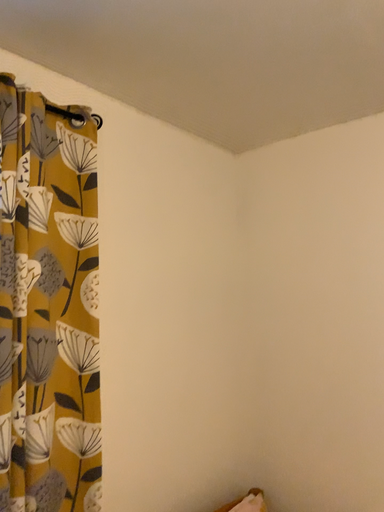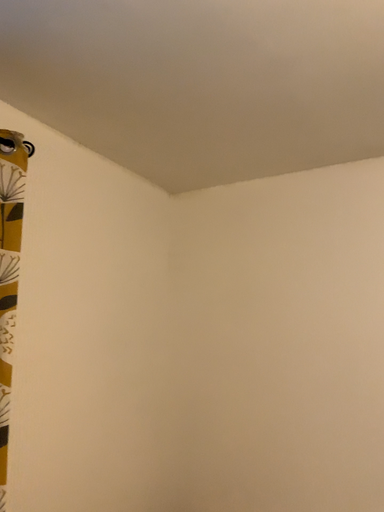
Question: How did the camera likely rotate when shooting the video?

Choices:
 (A) rotated left
 (B) rotated right

Answer: (B)